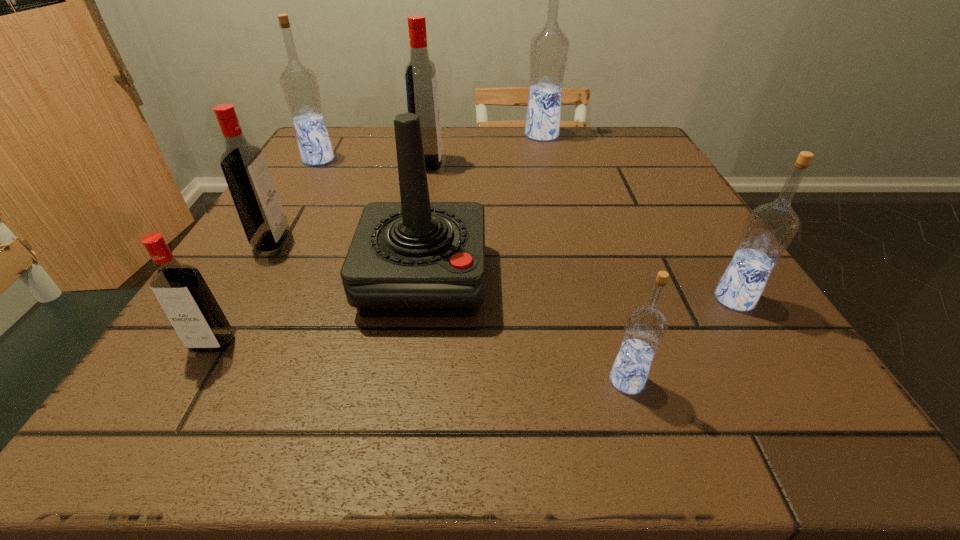
Where is `the biggest blue vodka`? the biggest blue vodka is located at coordinates (549, 48).

Where is `the tallest vodka`? the tallest vodka is located at coordinates (549, 48).

What are the coordinates of `the third nearest blue vodka` in the screenshot? It's located at (299, 84).

This screenshot has width=960, height=540. I want to click on the leftmost blue vodka, so click(x=299, y=84).

This screenshot has width=960, height=540. What are the coordinates of `the fourth vodka from left to right` in the screenshot? It's located at (420, 74).

The width and height of the screenshot is (960, 540). What are the coordinates of `the biggest red vodka` in the screenshot? It's located at (420, 74).

Locate an element on the screen. The width and height of the screenshot is (960, 540). joystick is located at coordinates (415, 258).

The width and height of the screenshot is (960, 540). Identify the location of the second smallest red vodka. (257, 202).

Locate an element on the screen. The width and height of the screenshot is (960, 540). the second nearest red vodka is located at coordinates (257, 202).

The image size is (960, 540). I want to click on the rightmost blue vodka, so click(769, 229).